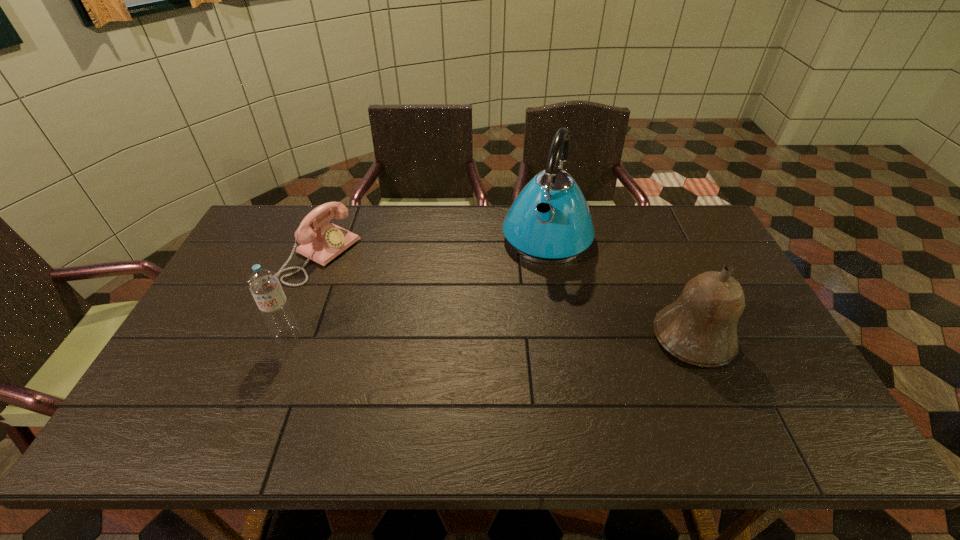
Find the location of `free space at the right edge of the desktop`. free space at the right edge of the desktop is located at coordinates (693, 272).

I want to click on vacant space at the far left corner of the desktop, so click(x=262, y=215).

In the image, there is a desktop. Identify the location of blank space at the near left corner. (189, 400).

At what (x,y) coordinates should I click in order to perform the action: click on vacant region at the far right corner of the desktop. Please return your answer as a coordinate pair (x, y). The width and height of the screenshot is (960, 540). Looking at the image, I should click on (663, 207).

In the image, there is a desktop. Where is `vacant region at the near right corner`? vacant region at the near right corner is located at coordinates (809, 406).

Identify the location of free space between the second object from right to left and the water bottle. The height and width of the screenshot is (540, 960). [418, 287].

Find the location of `free space between the tallest object and the bell`. free space between the tallest object and the bell is located at coordinates (620, 287).

What are the coordinates of `free space between the kettle and the rightmost object` in the screenshot? It's located at [620, 287].

Where is `free area in between the water bottle and the bell`? Image resolution: width=960 pixels, height=540 pixels. free area in between the water bottle and the bell is located at coordinates (491, 337).

You are a GUI agent. You are given a task and a screenshot of the screen. Output one action in this format:
    pyautogui.click(x=<x>, y=<y>)
    Task: Click on the vacant space in between the bell and the shortest object
    
    Given the screenshot: What is the action you would take?
    pyautogui.click(x=507, y=296)